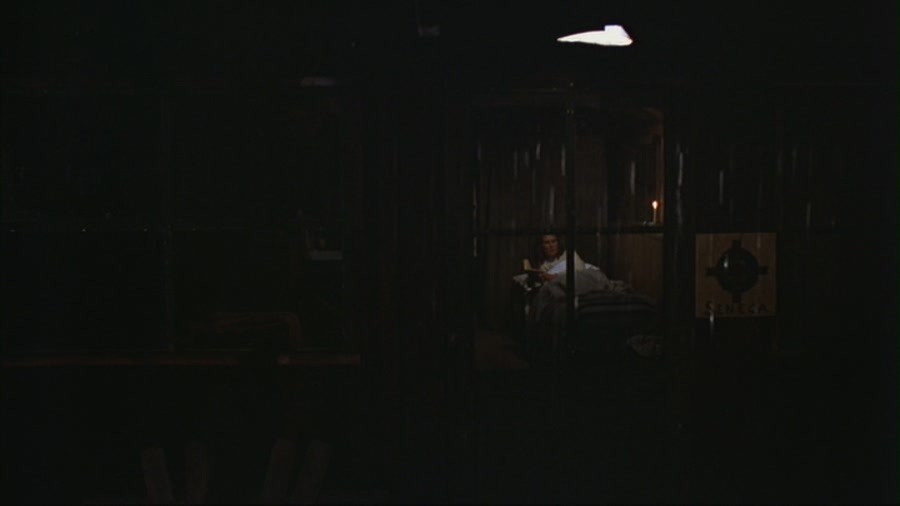
Identify the location of light. This screenshot has width=900, height=506. (655, 204).